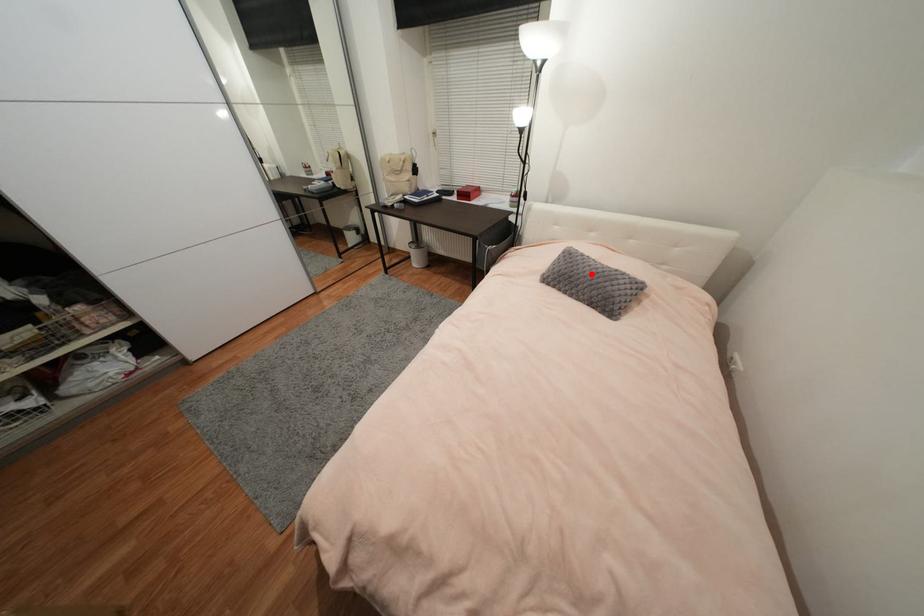
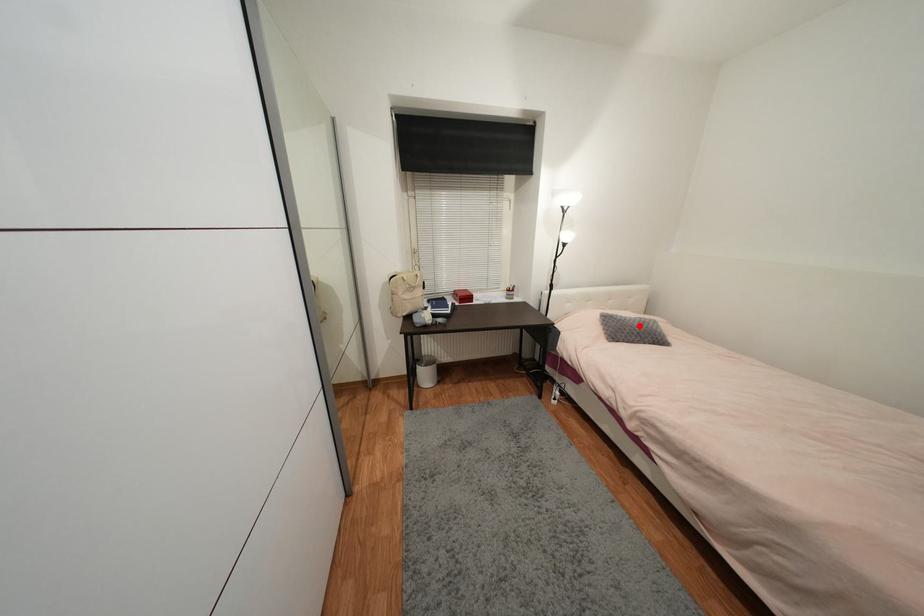
I am providing you with two images of the same scene from different viewpoints. A red point is marked on the first image and another point is marked on the second image. Does the point marked in image1 correspond to the same location as the one in image2?

Yes